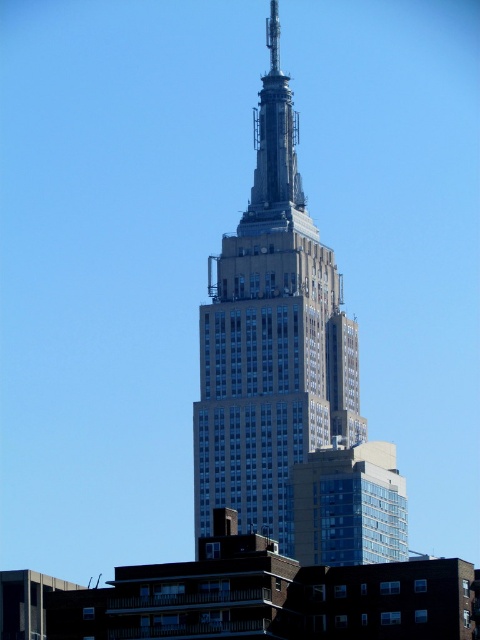
Measure the distance from white stone building at center to metallic silver spire at upper center.

The distance of white stone building at center from metallic silver spire at upper center is 14.65 meters.

Is white stone building at center shorter than metallic silver spire at upper center?

In fact, white stone building at center may be taller than metallic silver spire at upper center.

Identify the location of white stone building at center. The width and height of the screenshot is (480, 640). (271, 339).